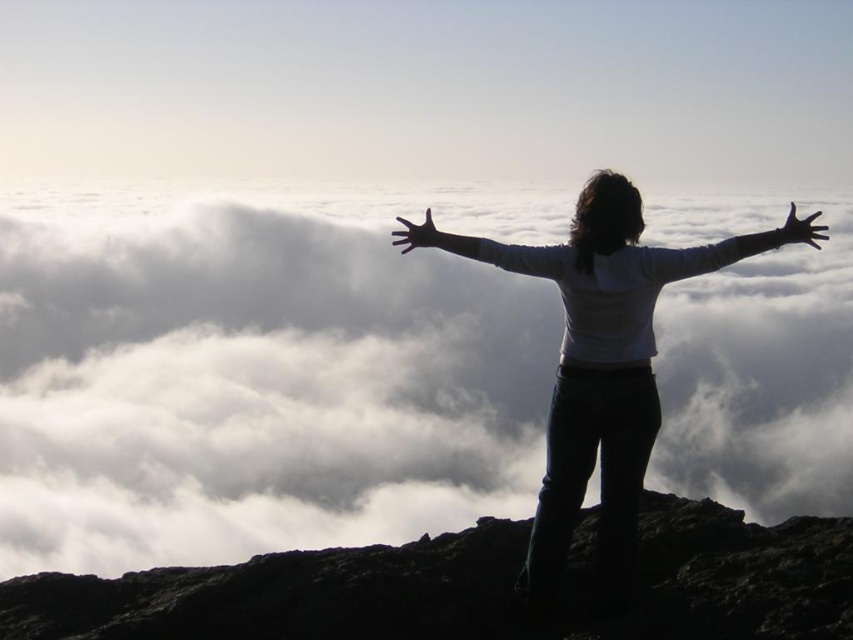
You are a photographer trying to capture the silhouette of the person in the image. You notice two points marked in the scene. The first point is at coordinate point (x=573, y=371) and the second is at point (x=786, y=230). Which point is closer to the camera and thus better suited for focusing to ensure the person remains sharp in the photo?

Point (x=573, y=371) is further to the camera than point (x=786, y=230), so the point closer to the camera is point (x=786, y=230). Therefore, focusing on point (x=786, y=230) would ensure the person remains sharp in the photo.

You are a photographer trying to capture the silvery metallic arm at upper right in the image. The camera is positioned at the point with coordinates point (734,248). Which direction should you move the camera to get the silvery metallic arm at upper right into the frame?

The point (734,248) corresponds to the silvery metallic arm at upper right, so moving the camera towards that coordinate will bring the silvery metallic arm at upper right into the frame.